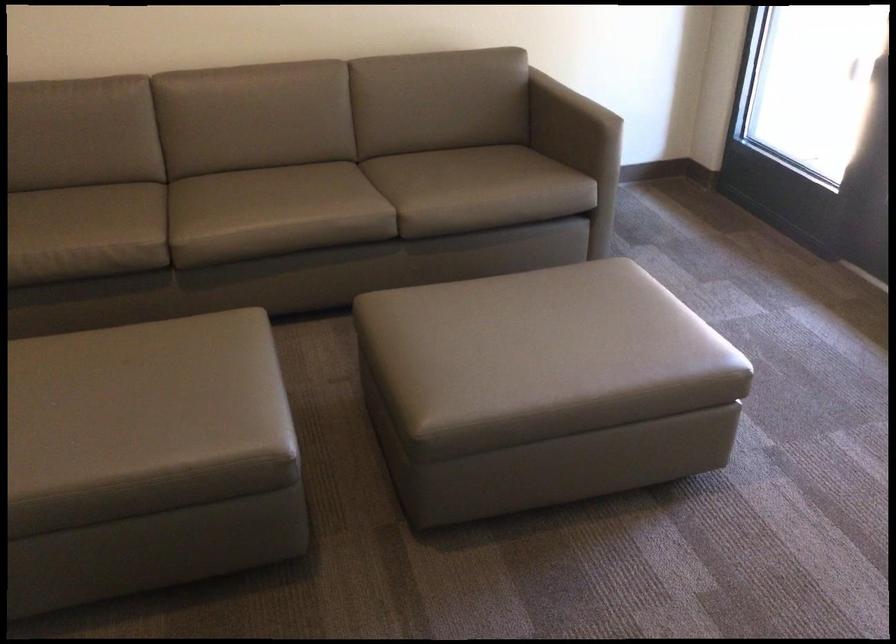
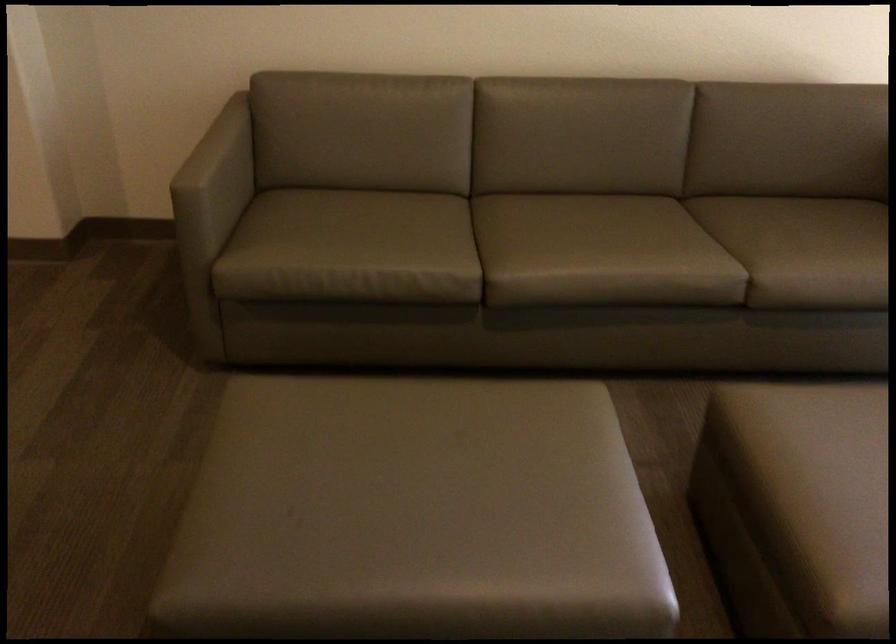
Find the pixel in the second image that matches (x=253, y=205) in the first image.

(583, 247)